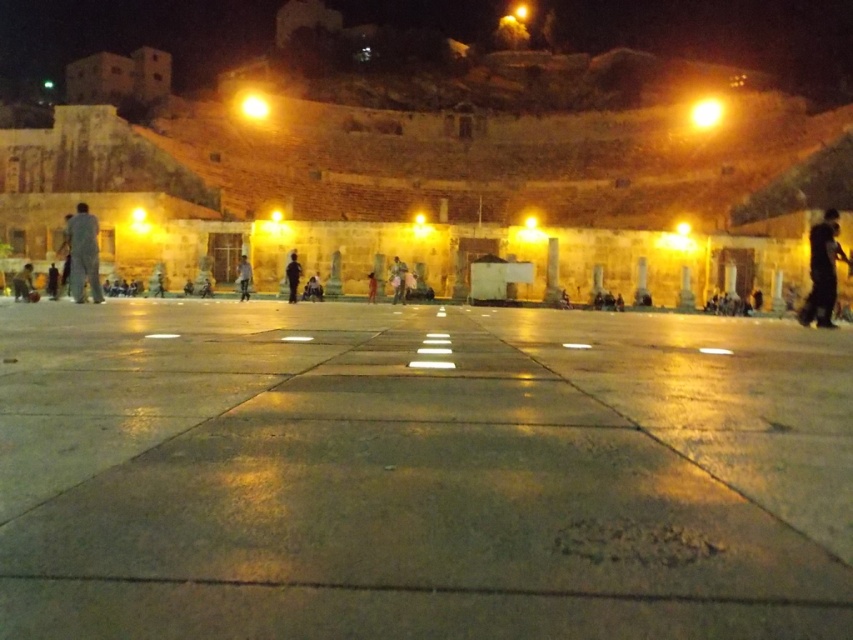
Question: Is smooth stone pillar at center closer to camera compared to light brown leather jacket at center?

Choices:
 (A) no
 (B) yes

Answer: (A)

Question: Observing the image, what is the correct spatial positioning of smooth stone pillar at center in reference to light brown leather jacket at lower left?

Choices:
 (A) left
 (B) right

Answer: (B)

Question: Which object appears farthest from the camera in this image?

Choices:
 (A) smooth stone pillar at center
 (B) light brown leather jacket at center
 (C) black matte person at center

Answer: (A)

Question: Which point appears farthest from the camera in this image?

Choices:
 (A) (809, 260)
 (B) (397, 259)

Answer: (B)

Question: Which point is farther to the camera?

Choices:
 (A) white marble pillar at center
 (B) light brown leather jacket at lower left
 (C) black matte person at right

Answer: (A)

Question: Can you confirm if smooth stone pillar at center is wider than light brown leather jacket at lower left?

Choices:
 (A) yes
 (B) no

Answer: (B)